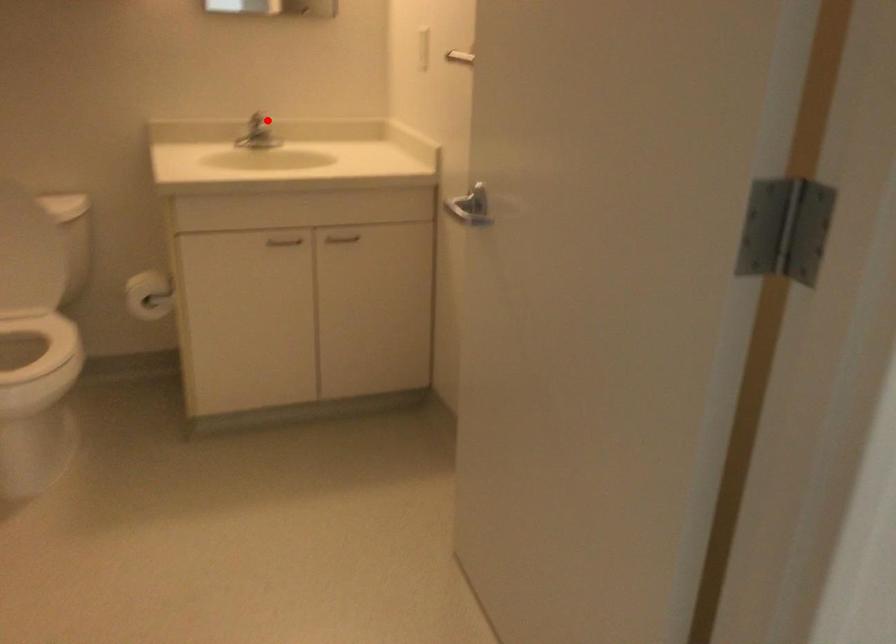
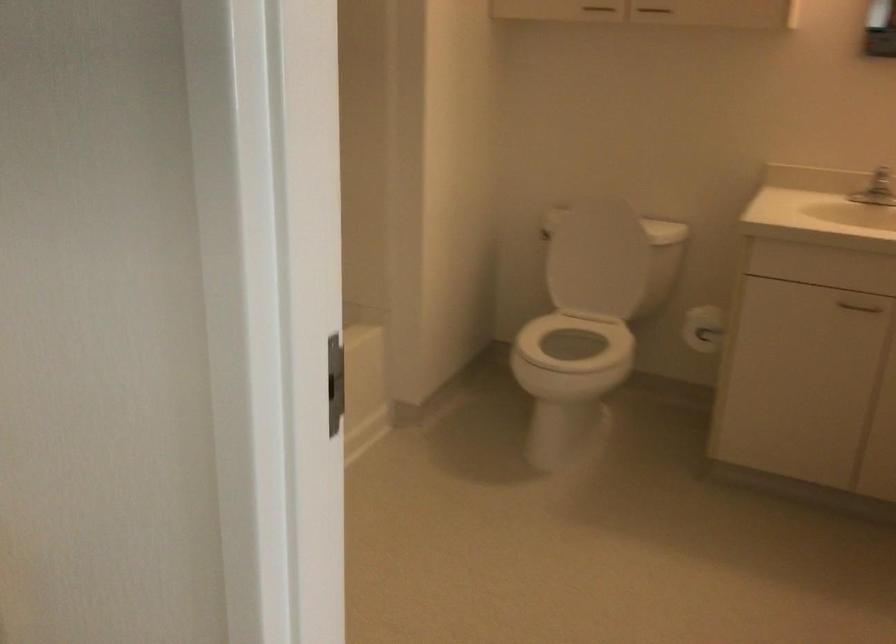
Question: I am providing you with two images of the same scene from different viewpoints. In image1, a red point is highlighted. Considering the same 3D point in image2, which of the following is correct?

Choices:
 (A) It is closer
 (B) It is farther

Answer: (A)